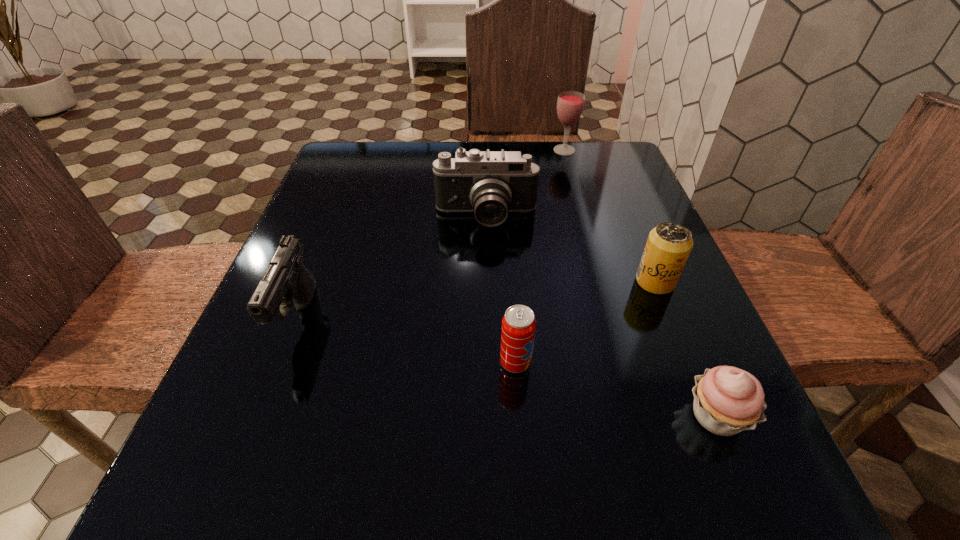
This screenshot has width=960, height=540. Find the location of `vacant area that lies between the soda can and the nearest object`. vacant area that lies between the soda can and the nearest object is located at coordinates (615, 389).

The width and height of the screenshot is (960, 540). What are the coordinates of `empty location between the beer can and the second farthest object` in the screenshot? It's located at (570, 250).

Find the location of a particular element. The height and width of the screenshot is (540, 960). free space between the leftmost object and the beer can is located at coordinates (477, 300).

This screenshot has height=540, width=960. Find the location of `vacant space in between the second farthest object and the beer can`. vacant space in between the second farthest object and the beer can is located at coordinates (570, 250).

I want to click on the closest object to the leftmost object, so click(x=490, y=184).

Where is `the fifth closest object to the fifth nearest object`? the fifth closest object to the fifth nearest object is located at coordinates (727, 400).

The image size is (960, 540). I want to click on blank area in the image that satisfies the following two spatial constraints: 1. on the front-facing side of the camera; 2. on the left side of the cupcake, so click(490, 416).

Identify the location of free space that satisfies the following two spatial constraints: 1. at the barrel of the soda can; 2. on the right side of the pistol. This screenshot has width=960, height=540. (281, 362).

Image resolution: width=960 pixels, height=540 pixels. I want to click on vacant region that satisfies the following two spatial constraints: 1. on the front-facing side of the camera; 2. on the right side of the cupcake, so click(x=490, y=416).

The width and height of the screenshot is (960, 540). I want to click on free location that satisfies the following two spatial constraints: 1. on the front side of the farthest object; 2. on the right side of the beer can, so click(x=601, y=281).